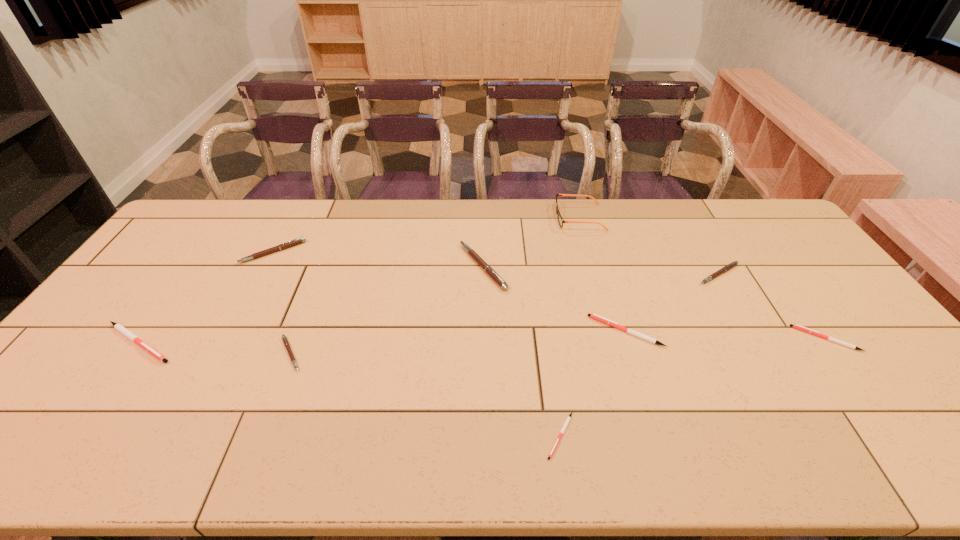
The width and height of the screenshot is (960, 540). Find the location of `the tallest object`. the tallest object is located at coordinates (560, 220).

Identify the location of the farthest object. (560, 220).

I want to click on the fourth pen from left to right, so click(471, 252).

Identify the location of the tallest pen. The height and width of the screenshot is (540, 960). (471, 252).

Locate an element on the screen. Image resolution: width=960 pixels, height=540 pixels. the second object from left to right is located at coordinates (297, 241).

This screenshot has width=960, height=540. Identify the location of the leftmost pink pen. (297, 241).

The height and width of the screenshot is (540, 960). I want to click on the leftmost white pen, so click(120, 328).

Where is `the biggest white pen`? the biggest white pen is located at coordinates (120, 328).

Image resolution: width=960 pixels, height=540 pixels. What are the coordinates of `the rightmost pink pen` in the screenshot? It's located at (731, 265).

At what (x,y) coordinates should I click in order to perform the action: click on the third biggest pink pen. Please return your answer as a coordinate pair (x, y). The height and width of the screenshot is (540, 960). Looking at the image, I should click on (x=731, y=265).